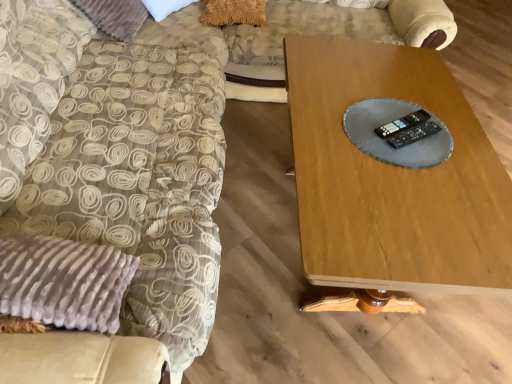
This screenshot has height=384, width=512. Identify the location of vacant point to the right of black plastic remote at center, which appears as the second control when ordered from the bottom. (456, 138).